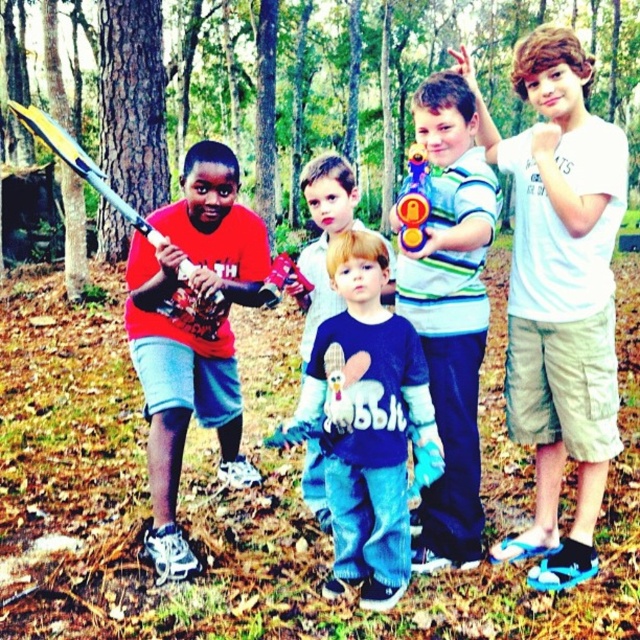
Question: Can you confirm if blue cotton shirt at center is wider than yellow plastic baseball bat at left?

Choices:
 (A) no
 (B) yes

Answer: (A)

Question: Estimate the real-world distances between objects in this image. Which object is farther from the white cotton t-shirt at upper right?

Choices:
 (A) yellow plastic baseball bat at left
 (B) blue fleece sweatshirt at center
 (C) blue cotton shirt at center
 (D) translucent plastic toy gun at center

Answer: (A)

Question: Which point is closer to the camera?

Choices:
 (A) translucent plastic toy gun at center
 (B) blue cotton shirt at center
 (C) striped jersey toy gun at center

Answer: (C)

Question: Considering the relative positions of blue cotton shirt at center and translucent plastic toy gun at center in the image provided, where is blue cotton shirt at center located with respect to translucent plastic toy gun at center?

Choices:
 (A) below
 (B) above

Answer: (A)

Question: Which point is farther from the camera taking this photo?

Choices:
 (A) (419, 166)
 (B) (124, 216)
 (C) (396, 225)

Answer: (B)

Question: Can you confirm if striped jersey toy gun at center is smaller than blue cotton shirt at center?

Choices:
 (A) yes
 (B) no

Answer: (A)